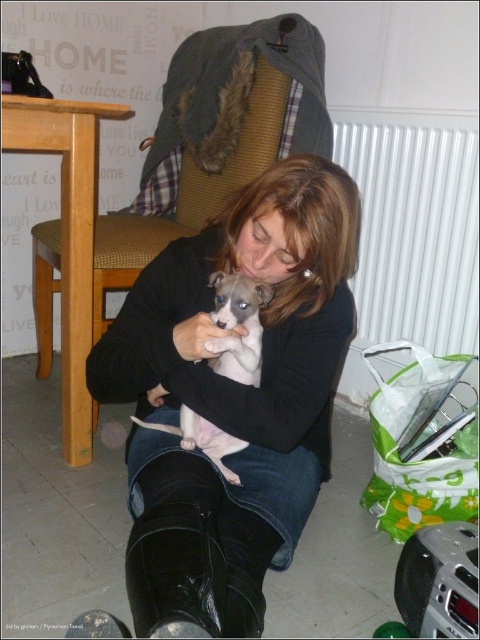
Which of these two, black leather boots at lower center or white fur puppy at center, stands shorter?

With less height is white fur puppy at center.

Which is behind, point (261, 403) or point (250, 381)?

Positioned behind is point (250, 381).

The width and height of the screenshot is (480, 640). In order to click on black leather boots at lower center in this screenshot , I will do `click(232, 397)`.